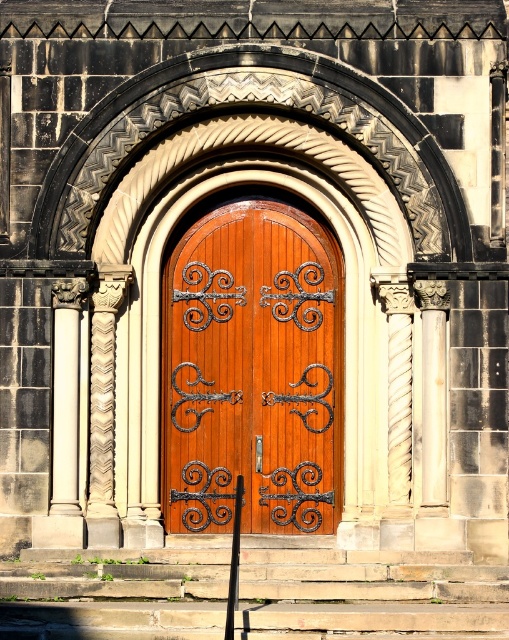
You are an architect measuring the space between two key elements in the doorway. You need to install a decorative beam that must span exactly 6 meters between the polished wood door at center and the carved stone column at left. Will the beam fit properly?

The distance between the polished wood door at center and the carved stone column at left is 5.79 meters. Since the beam requires 6 meters, it will be 0.21 meters too long and won

You are an architect assessing the structural integrity of the polished wood door at center and the carved stone column at left. Based on their heights, which one might require additional support to prevent bending under its own weight?

The polished wood door at center is much taller than the carved stone column at left, so it might require additional support to prevent bending under its own weight.